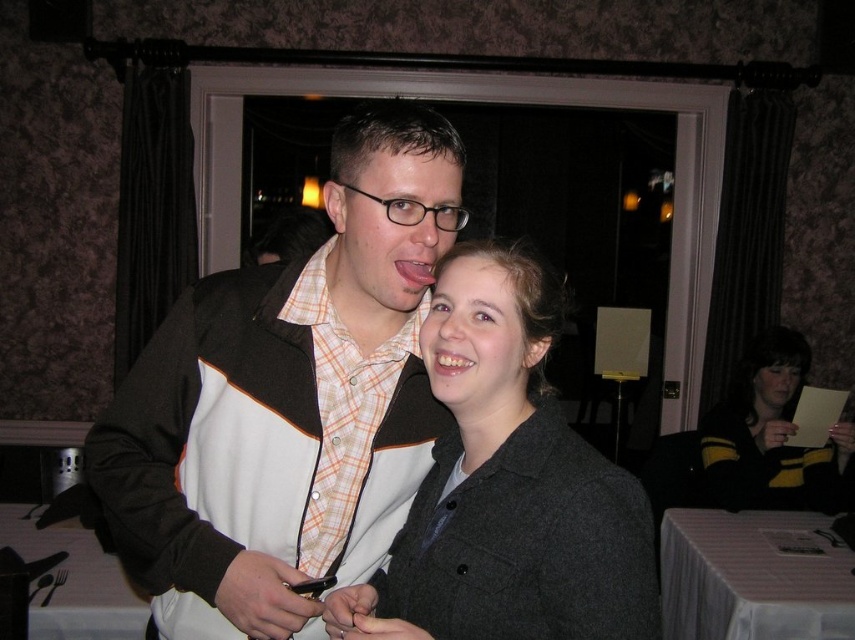
You are a photographer at the event and need to capture a clear photo of both the matte brown jacket at center and the matte gray coat at center. However, you can only position yourself in a way that allows you to see one of them fully. Which one should you focus on to ensure the other is partially visible in the background?

You should focus on the matte brown jacket at center because the matte gray coat at center is behind it, so by centering the matte brown jacket at center in your shot, the matte gray coat at center will naturally appear in the background, partially visible.